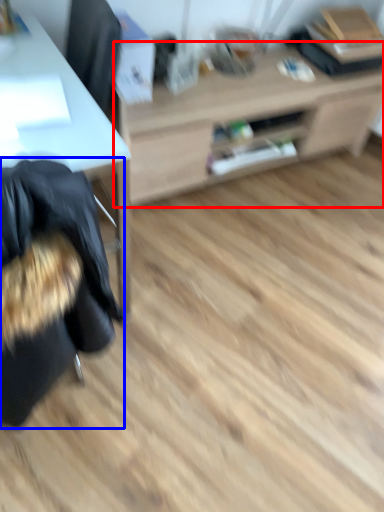
Question: Among these objects, which one is nearest to the camera, table (highlighted by a red box) or bean bag chair (highlighted by a blue box)?

Choices:
 (A) table
 (B) bean bag chair

Answer: (B)